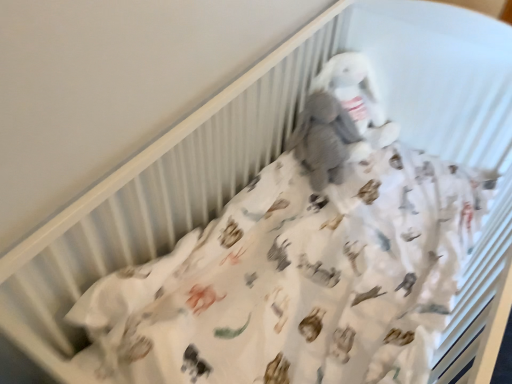
What do you see at coordinates (323, 139) in the screenshot? I see `white plush toy at center` at bounding box center [323, 139].

Image resolution: width=512 pixels, height=384 pixels. What are the coordinates of `white plush toy at center` in the screenshot? It's located at click(x=323, y=139).

You are a GUI agent. You are given a task and a screenshot of the screen. Output one action in this format:
    pyautogui.click(x=<x>, y=<y>)
    Task: Click on the gray plush toy at upper center
    The width and height of the screenshot is (512, 384).
    Given the screenshot: What is the action you would take?
    pyautogui.click(x=358, y=96)

This screenshot has width=512, height=384. What do you see at coordinates (358, 96) in the screenshot?
I see `gray plush toy at upper center` at bounding box center [358, 96].

Where is `white plush toy at center`? Image resolution: width=512 pixels, height=384 pixels. white plush toy at center is located at coordinates (323, 139).

Based on their positions, is gray plush toy at upper center located to the left or right of white plush toy at center?

From the image, it's evident that gray plush toy at upper center is to the right of white plush toy at center.

Does gray plush toy at upper center come in front of white plush toy at center?

No, it is behind white plush toy at center.

Between point (337, 77) and point (330, 107), which one is positioned in front?

The point (337, 77) is closer.

From the image's perspective, which object appears higher, gray plush toy at upper center or white plush toy at center?

From the image's view, gray plush toy at upper center is above.

From a real-world perspective, is gray plush toy at upper center above or below white plush toy at center?

gray plush toy at upper center is situated higher than white plush toy at center in the real world.

Between gray plush toy at upper center and white plush toy at center, which one has larger width?

gray plush toy at upper center is wider.

Considering the sizes of gray plush toy at upper center and white plush toy at center in the image, is gray plush toy at upper center taller or shorter than white plush toy at center?

Clearly, gray plush toy at upper center is taller compared to white plush toy at center.

Which of these two, gray plush toy at upper center or white plush toy at center, is bigger?

white plush toy at center is bigger.

Does gray plush toy at upper center contain white plush toy at center?

Yes.

Is gray plush toy at upper center not close to white plush toy at center?

gray plush toy at upper center is near white plush toy at center, not far away.

Is gray plush toy at upper center facing towards white plush toy at center?

Yes, gray plush toy at upper center is facing white plush toy at center.

How different are the orientations of gray plush toy at upper center and white plush toy at center in degrees?

gray plush toy at upper center and white plush toy at center are facing 0.0026 degrees away from each other.

How far apart are gray plush toy at upper center and white plush toy at center?

gray plush toy at upper center is 4.93 inches from white plush toy at center.

What are the coordinates of `baby elephant below the gray plush toy at upper center (from the image's perspective)` in the screenshot? It's located at (323, 139).

Which object is positioned more to the right, white plush toy at center or gray plush toy at upper center?

Result: Positioned to the right is gray plush toy at upper center.

Which object is more forward, white plush toy at center or gray plush toy at upper center?

white plush toy at center.

Is point (316, 177) closer or farther from the camera than point (376, 87)?

Point (316, 177) is positioned closer to the camera compared to point (376, 87).

From the image's perspective, between white plush toy at center and gray plush toy at upper center, who is located below?

white plush toy at center.

From a real-world perspective, who is located higher, white plush toy at center or gray plush toy at upper center?

gray plush toy at upper center.

Consider the image. Is white plush toy at center thinner than gray plush toy at upper center?

Indeed, white plush toy at center has a lesser width compared to gray plush toy at upper center.

Based on the photo, is white plush toy at center taller than gray plush toy at upper center?

No, white plush toy at center is not taller than gray plush toy at upper center.

Considering the relative sizes of white plush toy at center and gray plush toy at upper center in the image provided, is white plush toy at center smaller than gray plush toy at upper center?

No, white plush toy at center is not smaller than gray plush toy at upper center.

Would you say gray plush toy at upper center is part of white plush toy at center's contents?

Yes, white plush toy at center is surrounding gray plush toy at upper center.

Are white plush toy at center and gray plush toy at upper center making contact?

No, white plush toy at center is not with gray plush toy at upper center.

Is white plush toy at center facing away from gray plush toy at upper center?

No, white plush toy at center is not facing away from gray plush toy at upper center.

How different are the orientations of white plush toy at center and gray plush toy at upper center in degrees?

white plush toy at center and gray plush toy at upper center are facing 0.0026 degrees away from each other.

In order to click on baby elephant below the gray plush toy at upper center (from the image's perspective) in this screenshot , I will do `click(323, 139)`.

Image resolution: width=512 pixels, height=384 pixels. I want to click on toy behind the white plush toy at center, so click(358, 96).

The image size is (512, 384). I want to click on baby elephant on the left of gray plush toy at upper center, so click(323, 139).